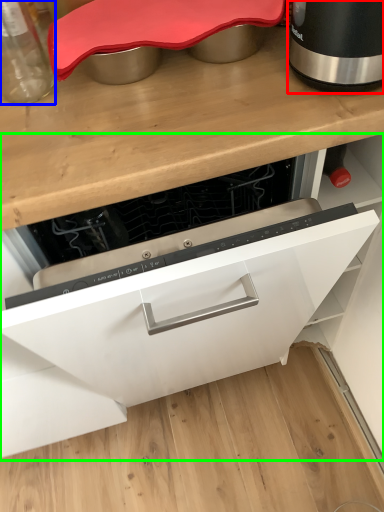
Question: Considering the real-world distances, which object is closest to home appliance (highlighted by a red box)? kitchen appliance (highlighted by a blue box) or cabinetry (highlighted by a green box).

Choices:
 (A) kitchen appliance
 (B) cabinetry

Answer: (A)